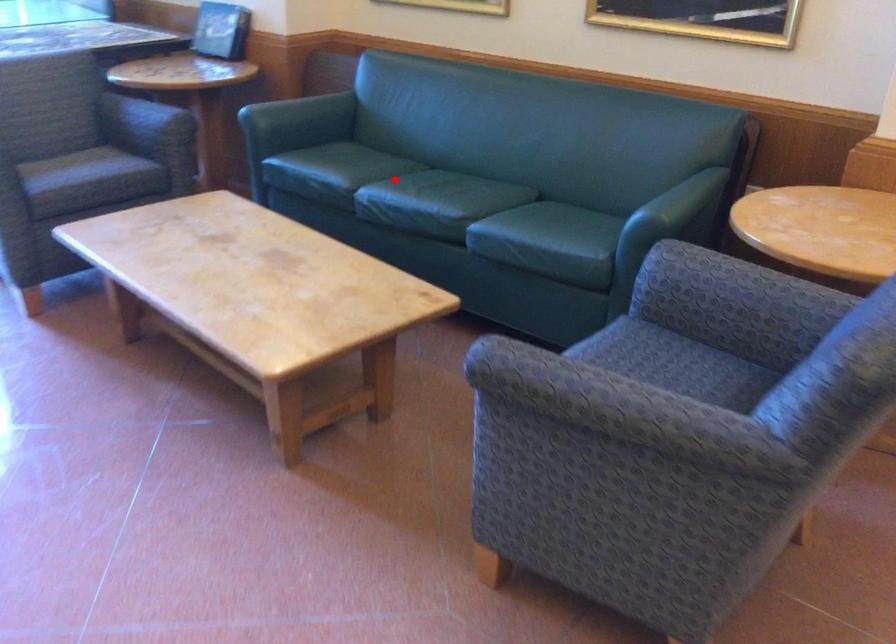
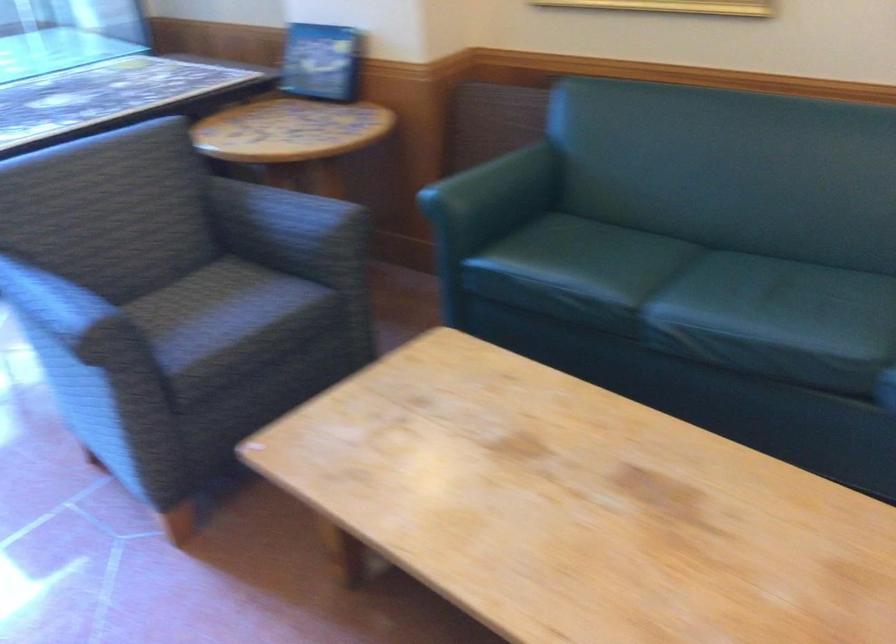
Locate, in the second image, the point that corresponds to the highlighted location in the first image.

(679, 283)